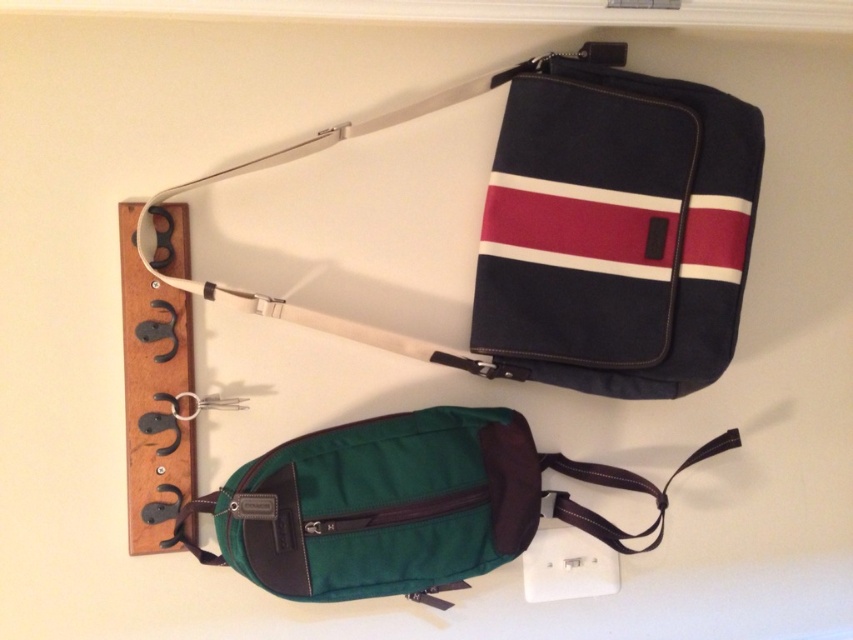
From the picture: You are standing 1.5 meters away from the wall where the hook rack is mounted. You want to reach the point marked at coordinates point (608, 144). Can you touch it with a 1.3 meter long stick?

The point point (608, 144) is 1.17 meters from the camera. Since you are standing 1.5 meters away from the wall, the total distance from your position to the point is 1.5 meters plus 1.17 meters, totaling 2.67 meters. The stick is only 1.3 meters long, so you cannot reach it.

You need to choose a bag to carry your laptop. You see a navy canvas shoulder bag at upper right and a green fabric pouch at lower center. Which bag is more suitable for carrying a laptop based on their sizes?

The navy canvas shoulder bag at upper right is more suitable for carrying a laptop because it has a larger size compared to the green fabric pouch at lower center.